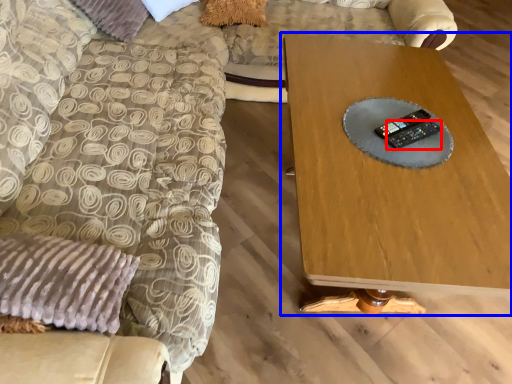
Question: Which of the following is the farthest to the observer, control (highlighted by a red box) or table (highlighted by a blue box)?

Choices:
 (A) control
 (B) table

Answer: (A)